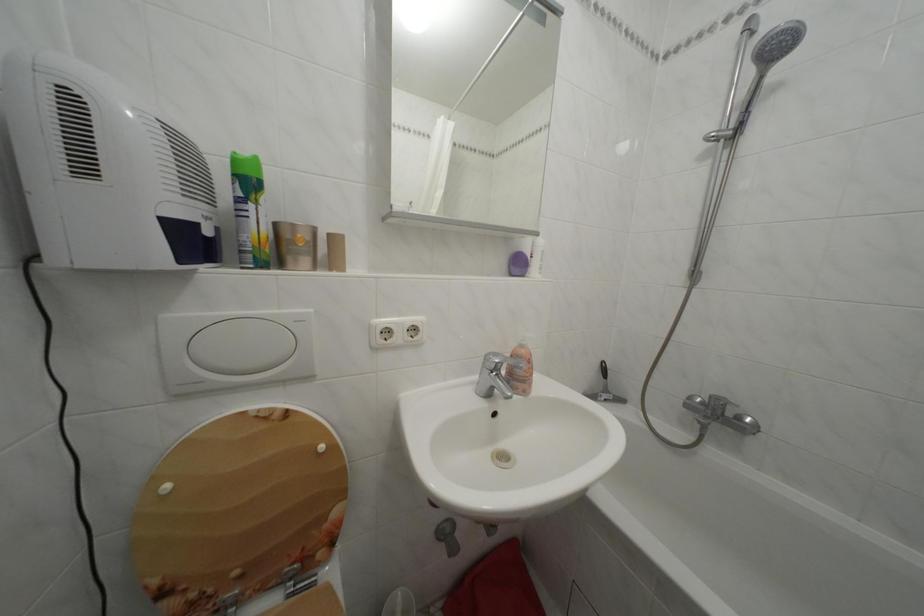
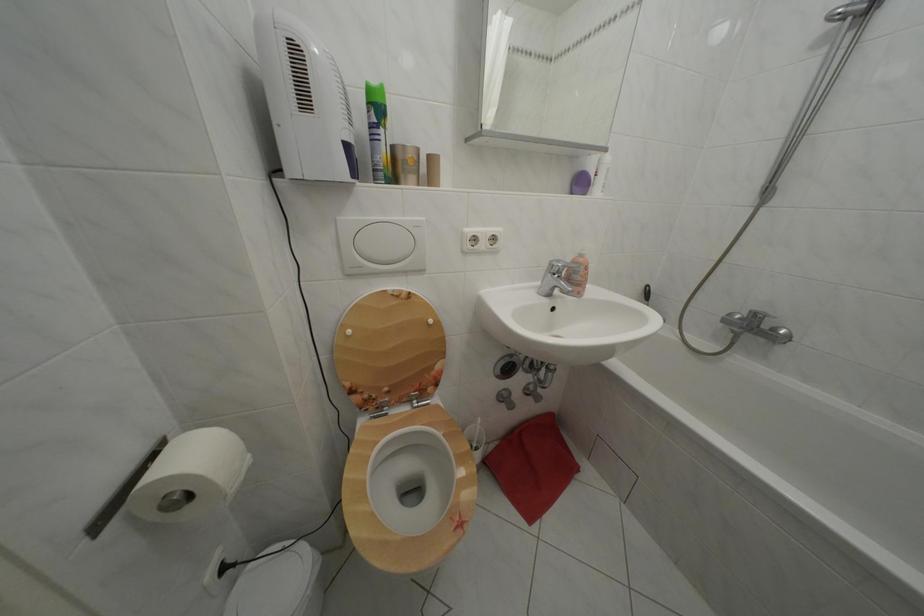
The point at (242, 182) is marked in the first image. Where is the corresponding point in the second image?

(378, 110)